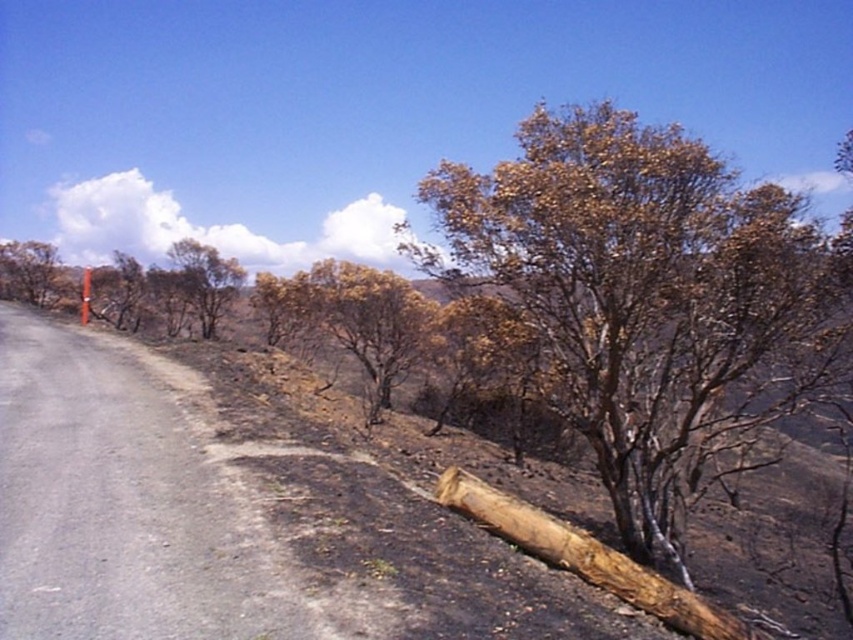
You are a hiker trying to cross the road in the image. There is a large fallen tree trunk blocking your path. You notice a point at coordinates (647, 298). What object is located at this point?

The point at coordinates (647, 298) corresponds to the brown dried bark tree at right.

You are a delivery driver trying to navigate through the scene. You see the gray asphalt road at left and the brown dry wood at center. Which object is taller?

The brown dry wood at center is taller than the gray asphalt road at left.